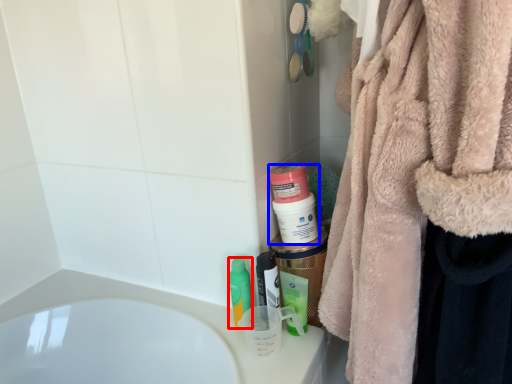
Question: Which object is further to the camera taking this photo, mouthwash (highlighted by a red box) or mouthwash (highlighted by a blue box)?

Choices:
 (A) mouthwash
 (B) mouthwash

Answer: (A)